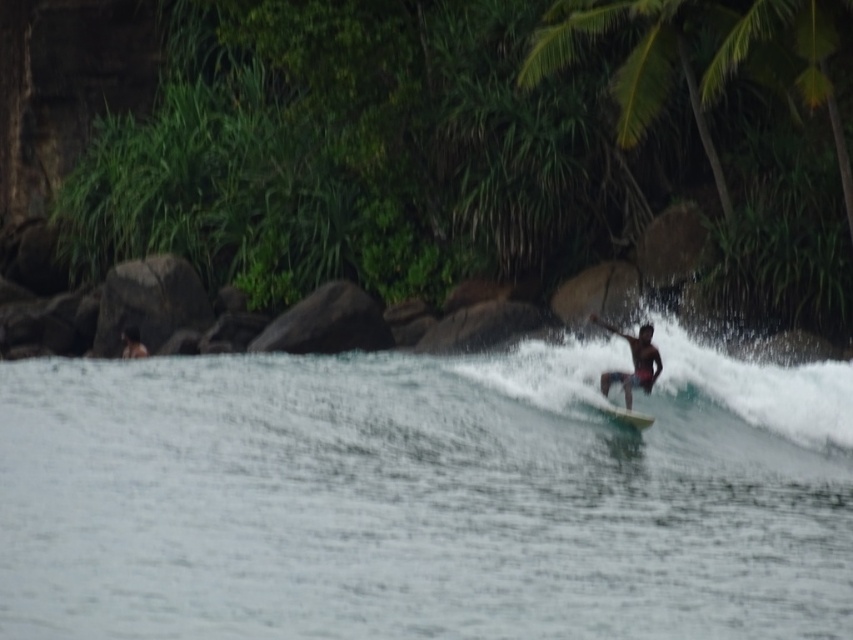
Question: Is green leafy vegetation at center closer to the viewer compared to white smooth wave at center?

Choices:
 (A) no
 (B) yes

Answer: (A)

Question: Among these points, which one is farthest from the camera?

Choices:
 (A) click(x=329, y=156)
 (B) click(x=138, y=346)
 (C) click(x=442, y=515)
 (D) click(x=608, y=332)

Answer: (A)

Question: Which object is farther from the camera taking this photo?

Choices:
 (A) smooth gray rock at center
 (B) clear water at surfboard right

Answer: (A)

Question: Which point is farther from the camera taking this photo?

Choices:
 (A) (622, 337)
 (B) (250, 342)
 (C) (132, 324)
 (D) (628, 428)

Answer: (C)

Question: Is green leafy vegetation at center thinner than white smooth wave at center?

Choices:
 (A) no
 (B) yes

Answer: (A)

Question: Observing the image, what is the correct spatial positioning of clear water at surfboard right in reference to white smooth wave at center?

Choices:
 (A) above
 (B) below

Answer: (B)